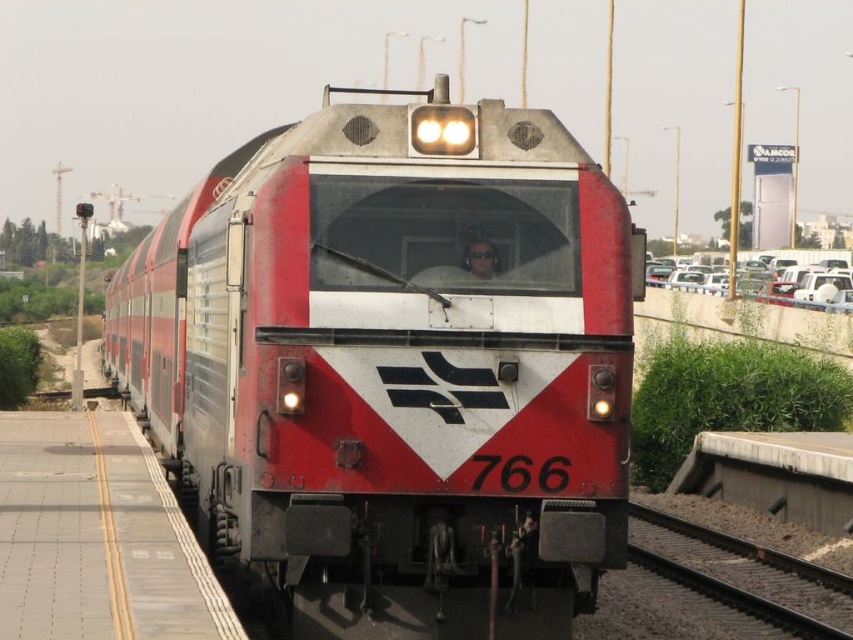
Is metallic red train at center to the left of gray concrete platform at lower left from the viewer's perspective?

Yes, metallic red train at center is to the left of gray concrete platform at lower left.

Is metallic red train at center to the right of gray concrete platform at lower left from the viewer's perspective?

In fact, metallic red train at center is to the left of gray concrete platform at lower left.

Locate an element on the screen. Image resolution: width=853 pixels, height=640 pixels. metallic red train at center is located at coordinates point(393,368).

Who is lower down, gray concrete platform at lower left or black metal train track at lower right?

black metal train track at lower right is below.

Which is behind, point (177, 525) or point (666, 531)?

The point (666, 531) is more distant.

The width and height of the screenshot is (853, 640). Identify the location of gray concrete platform at lower left. (96, 536).

Which is more to the left, metallic red train at center or black metal train track at lower right?

metallic red train at center

Can you confirm if metallic red train at center is positioned below black metal train track at lower right?

No.

Is point (190, 428) farther from viewer compared to point (773, 576)?

No, it is not.

You are a GUI agent. You are given a task and a screenshot of the screen. Output one action in this format:
    pyautogui.click(x=<x>, y=<y>)
    Task: Click on the metallic red train at center
    The width and height of the screenshot is (853, 640).
    Given the screenshot: What is the action you would take?
    pyautogui.click(x=393, y=368)